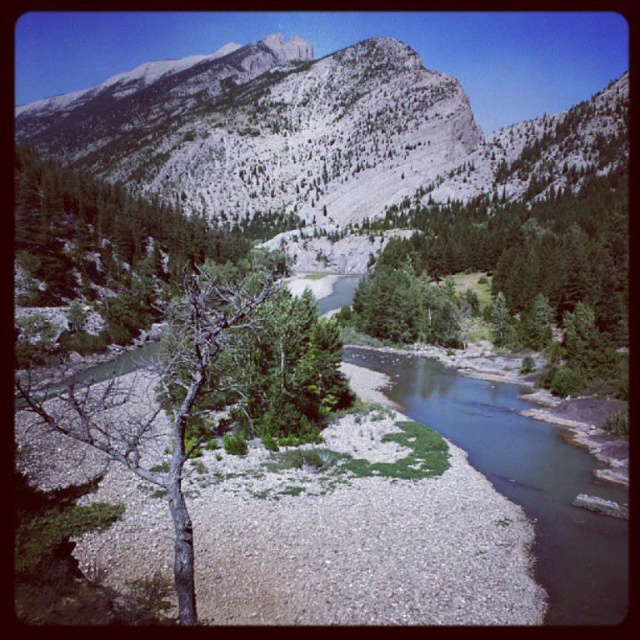
Question: Does gray rocky mountain at upper center appear on the left side of smooth gravel creek at center?

Choices:
 (A) no
 (B) yes

Answer: (B)

Question: Can you confirm if gray rocky mountain at upper center is positioned above smooth gravel creek at center?

Choices:
 (A) no
 (B) yes

Answer: (B)

Question: Which object is farther from the camera taking this photo?

Choices:
 (A) smooth gravel creek at center
 (B) gray rocky mountain at upper center

Answer: (B)

Question: Which point is closer to the camera?

Choices:
 (A) (376, 108)
 (B) (577, 586)

Answer: (B)

Question: Does gray rocky mountain at upper center have a greater width compared to smooth gravel creek at center?

Choices:
 (A) no
 (B) yes

Answer: (B)